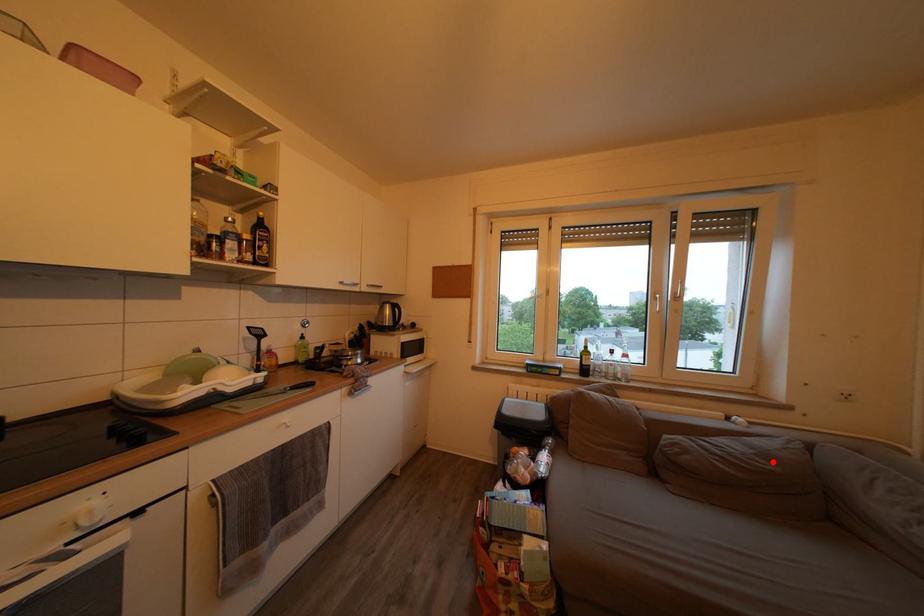
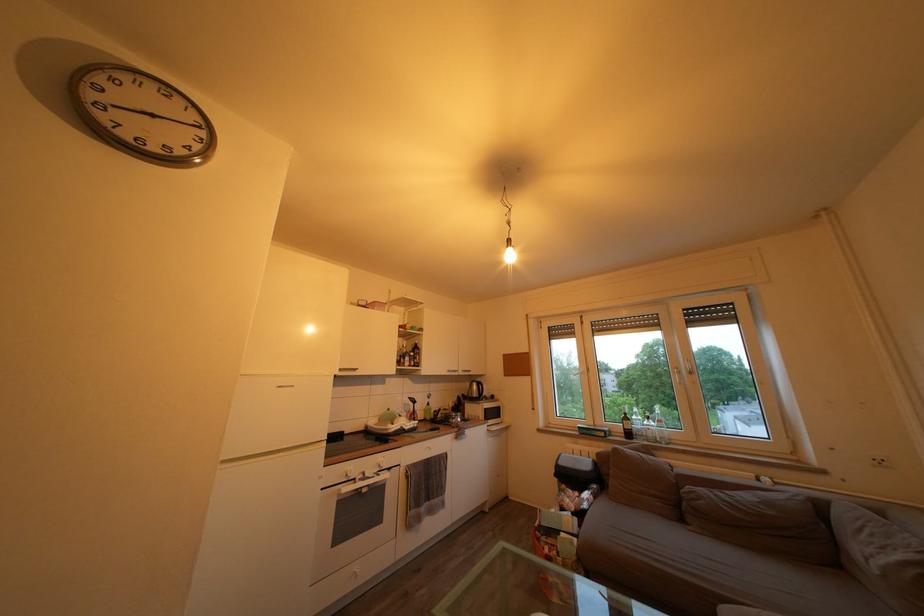
Question: I am providing you with two images of the same scene from different viewpoints. Image1 has a red point marked. In image2, the corresponding 3D location appears at what relative position? Reply with the corresponding letter.

Choices:
 (A) Closer
 (B) Farther

Answer: (A)